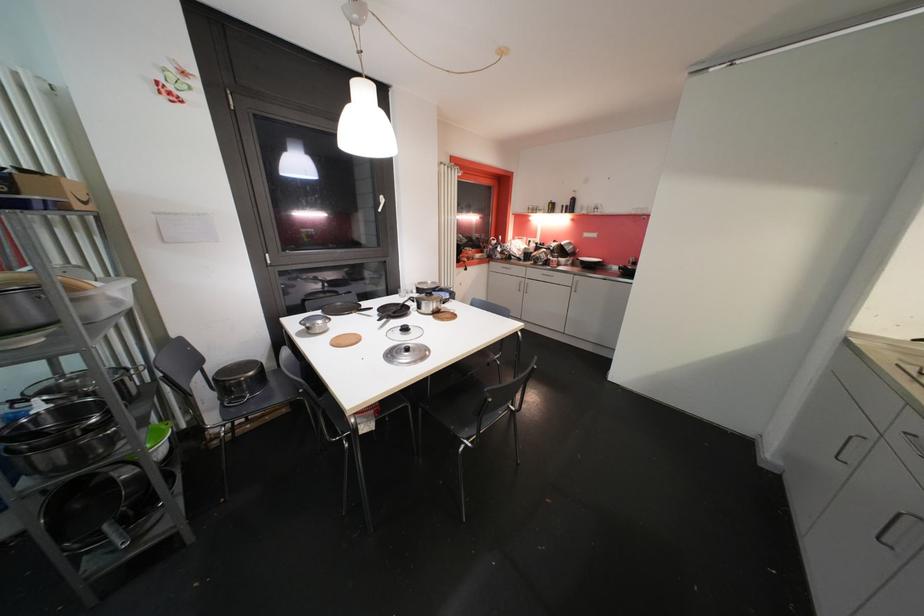
Find where to lift the metal pot lid handle. Please return your answer as a coordinate pair (x, y).

(406, 331)